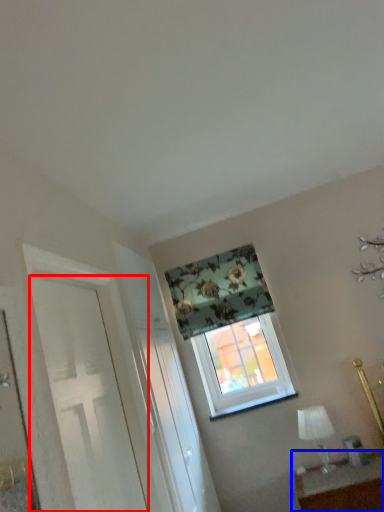
Question: Which object appears closest to the camera in this image, door (highlighted by a red box) or table (highlighted by a blue box)?

Choices:
 (A) door
 (B) table

Answer: (A)